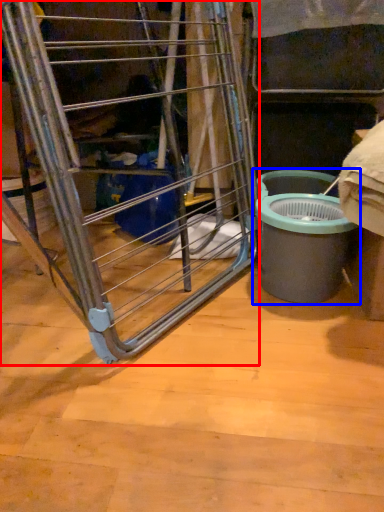
Question: Among these objects, which one is nearest to the camera, ladder (highlighted by a red box) or waste container (highlighted by a blue box)?

Choices:
 (A) ladder
 (B) waste container

Answer: (A)